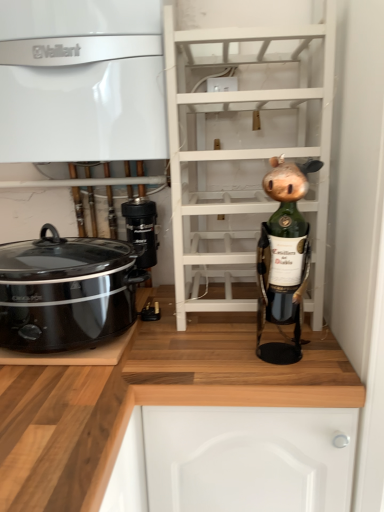
Question: Is wooden at lower right, which is counted as the 1th cabinetry, starting from the bottom, to the right of white glossy vaillant boiler at upper left, placed as the first cabinetry when sorted from top to bottom, from the viewer's perspective?

Choices:
 (A) no
 (B) yes

Answer: (B)

Question: Is wooden at lower right, which is counted as the 1th cabinetry, starting from the bottom, closer to the viewer compared to white glossy vaillant boiler at upper left, the second cabinetry ordered from the bottom?

Choices:
 (A) yes
 (B) no

Answer: (A)

Question: Considering the relative sizes of wooden at lower right, which is the second cabinetry in top-to-bottom order, and white glossy vaillant boiler at upper left, placed as the first cabinetry when sorted from top to bottom, in the image provided, is wooden at lower right, which is the second cabinetry in top-to-bottom order, shorter than white glossy vaillant boiler at upper left, placed as the first cabinetry when sorted from top to bottom,?

Choices:
 (A) no
 (B) yes

Answer: (A)

Question: Is wooden at lower right, which is counted as the 1th cabinetry, starting from the bottom, facing away from white glossy vaillant boiler at upper left, the second cabinetry ordered from the bottom?

Choices:
 (A) yes
 (B) no

Answer: (B)

Question: From the image's perspective, is wooden at lower right, which is the second cabinetry in top-to-bottom order, over white glossy vaillant boiler at upper left, placed as the first cabinetry when sorted from top to bottom?

Choices:
 (A) no
 (B) yes

Answer: (A)

Question: Would you say white wooden shelf at center is inside or outside green matte wine bottle at right?

Choices:
 (A) inside
 (B) outside

Answer: (B)

Question: Is white wooden shelf at center wider or thinner than green matte wine bottle at right?

Choices:
 (A) thin
 (B) wide

Answer: (B)

Question: Based on their positions, is white wooden shelf at center located to the left or right of green matte wine bottle at right?

Choices:
 (A) right
 (B) left

Answer: (B)

Question: Is point coord(226,45) closer or farther from the camera than point coord(297,291)?

Choices:
 (A) closer
 (B) farther

Answer: (B)

Question: From a real-world perspective, is black plastic camera at center above or below white wooden shelf at center?

Choices:
 (A) below
 (B) above

Answer: (A)

Question: Considering the relative positions of black plastic camera at center and white wooden shelf at center in the image provided, is black plastic camera at center to the left or to the right of white wooden shelf at center?

Choices:
 (A) left
 (B) right

Answer: (A)

Question: From the image's perspective, relative to white wooden shelf at center, is black plastic camera at center above or below?

Choices:
 (A) above
 (B) below

Answer: (B)

Question: Is black plastic camera at center bigger or smaller than white wooden shelf at center?

Choices:
 (A) big
 (B) small

Answer: (B)

Question: From the image's perspective, is black plastic slow cooker at left positioned above or below white glossy vaillant boiler at upper left, placed as the first cabinetry when sorted from top to bottom?

Choices:
 (A) above
 (B) below

Answer: (B)

Question: Is point (56, 252) positioned closer to the camera than point (9, 76)?

Choices:
 (A) closer
 (B) farther

Answer: (B)